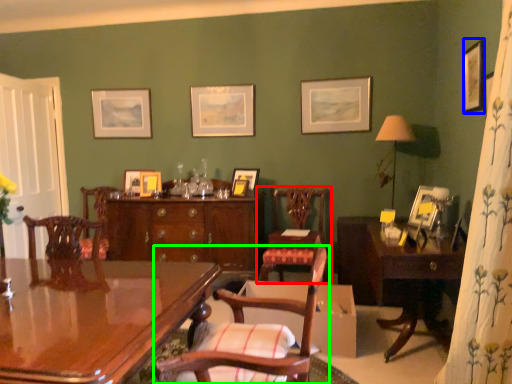
Question: Estimate the real-world distances between objects in this image. Which object is closer to chair (highlighted by a red box), picture frame (highlighted by a blue box) or chair (highlighted by a green box)?

Choices:
 (A) picture frame
 (B) chair

Answer: (A)